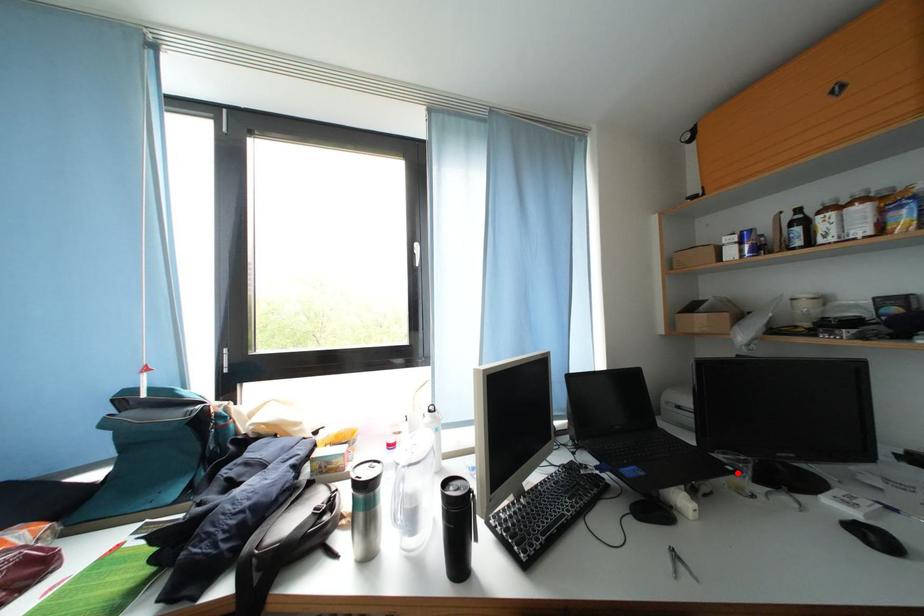
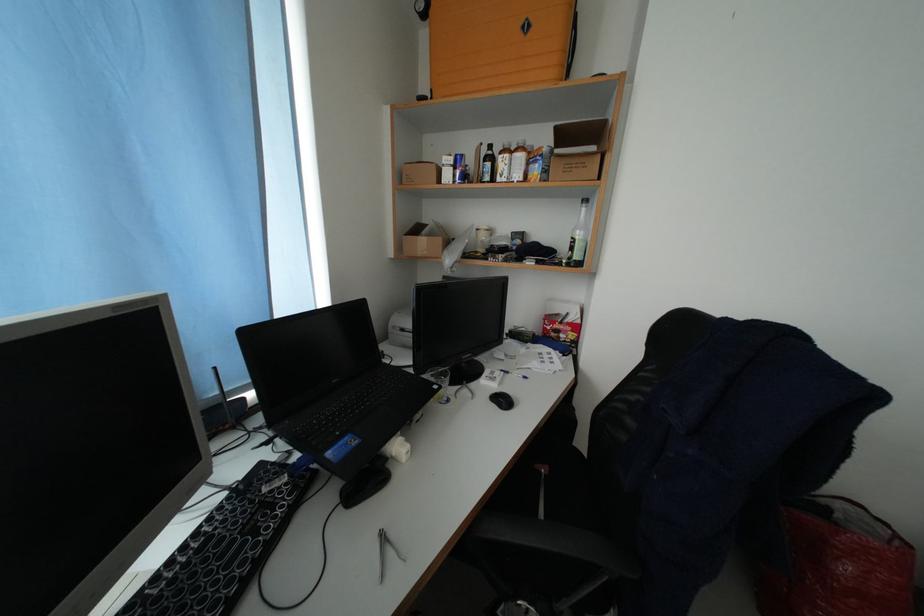
In the second image, find the point that corresponds to the highlighted location in the first image.

(444, 392)